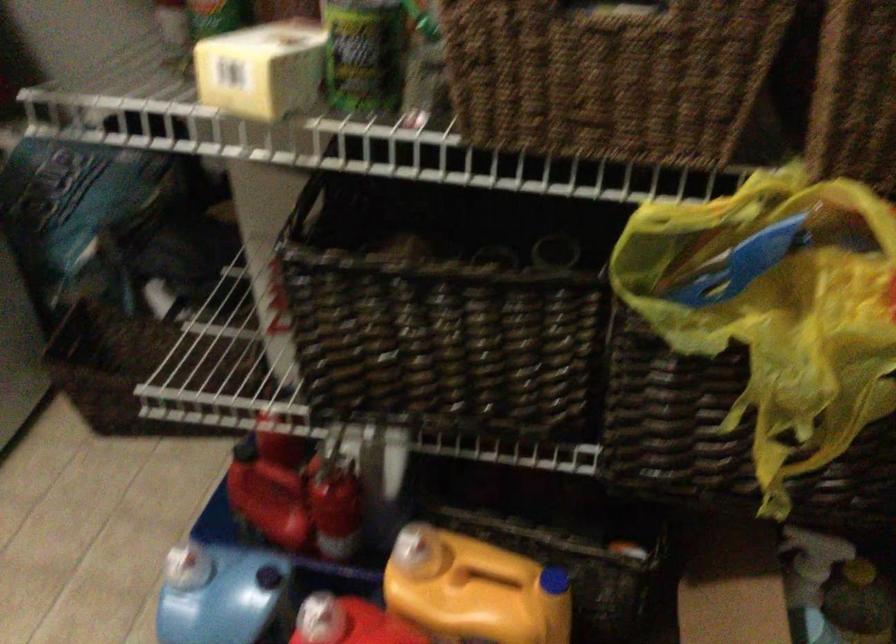
Image resolution: width=896 pixels, height=644 pixels. I want to click on yellow cardboard box, so click(x=261, y=70).